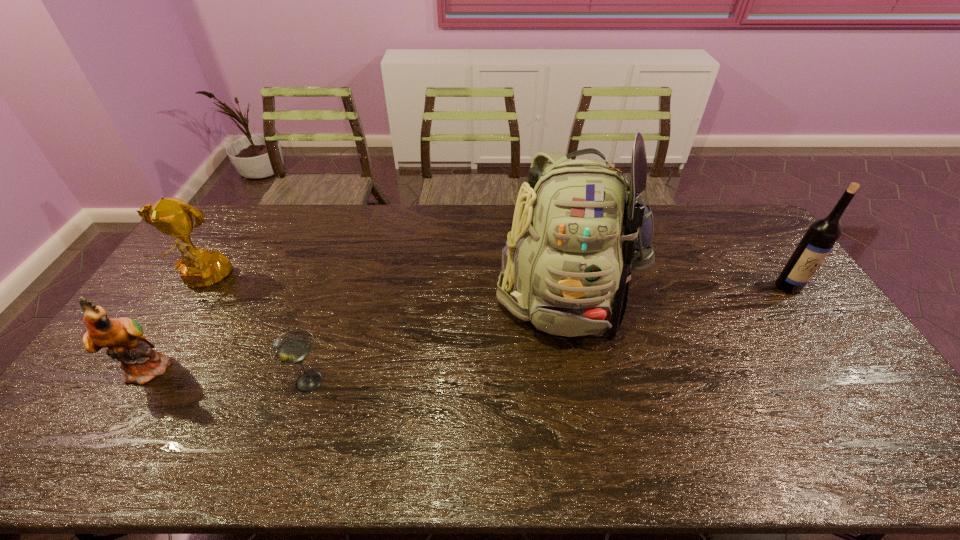
Image resolution: width=960 pixels, height=540 pixels. I want to click on free location located on the front side of the award, so 174,325.

Where is `vacant region located 0.370m on the front-facing side of the parrot`? This screenshot has height=540, width=960. vacant region located 0.370m on the front-facing side of the parrot is located at coordinates (308, 368).

You are a GUI agent. You are given a task and a screenshot of the screen. Output one action in this format:
    pyautogui.click(x=<x>, y=<y>)
    Task: Click on the blank space located on the right of the martini
    
    Given the screenshot: What is the action you would take?
    pyautogui.click(x=465, y=381)

Where is `object that is at the far edge`? The width and height of the screenshot is (960, 540). object that is at the far edge is located at coordinates (579, 228).

This screenshot has height=540, width=960. I want to click on award at the left edge, so click(x=199, y=268).

Find the location of a particular element. Image resolution: width=960 pixels, height=540 pixels. parrot present at the left edge is located at coordinates (123, 337).

Locate an element on the screen. object located at the right edge is located at coordinates (822, 234).

At what (x,y) coordinates should I click in order to perform the action: click on vacant area at the far edge. Please return your answer as a coordinate pair (x, y). This screenshot has width=960, height=540. Looking at the image, I should click on (701, 213).

I want to click on vacant space at the near edge of the desktop, so [x=139, y=445].

Locate an element on the screen. The image size is (960, 540). free region at the left edge is located at coordinates (88, 397).